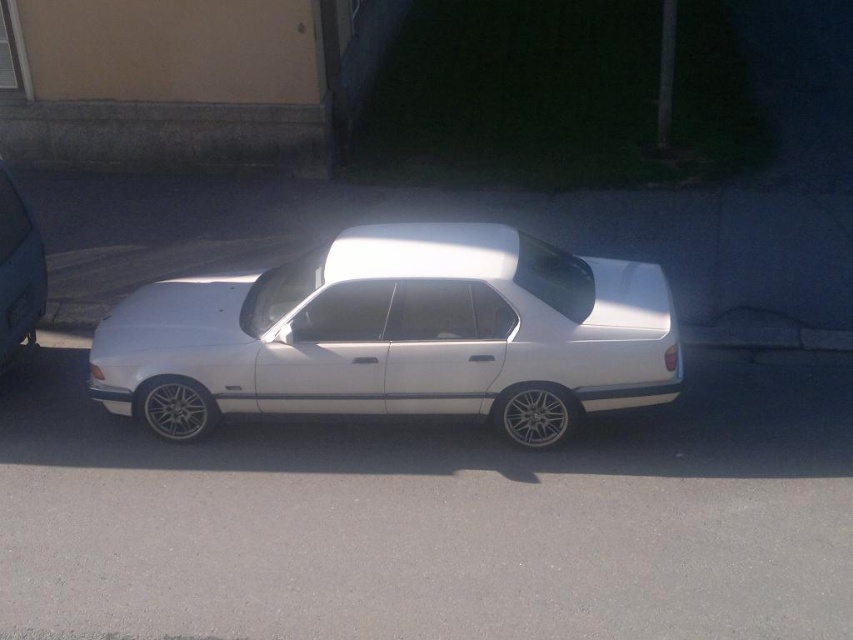
Question: Which of the following is the closest to the observer?

Choices:
 (A) (4, 332)
 (B) (409, 292)

Answer: (B)

Question: Can you confirm if white metallic car at center is thinner than black plastic license plate at center?

Choices:
 (A) yes
 (B) no

Answer: (B)

Question: Which of these objects is positioned closest to the metallic silver car at left?

Choices:
 (A) white metallic car at center
 (B) black plastic license plate at center

Answer: (B)

Question: Can you confirm if white metallic car at center is bigger than black plastic license plate at center?

Choices:
 (A) no
 (B) yes

Answer: (B)

Question: Based on their relative distances, which object is nearer to the black plastic license plate at center?

Choices:
 (A) white metallic car at center
 (B) metallic silver car at left

Answer: (B)

Question: Is metallic silver car at left smaller than black plastic license plate at center?

Choices:
 (A) no
 (B) yes

Answer: (A)